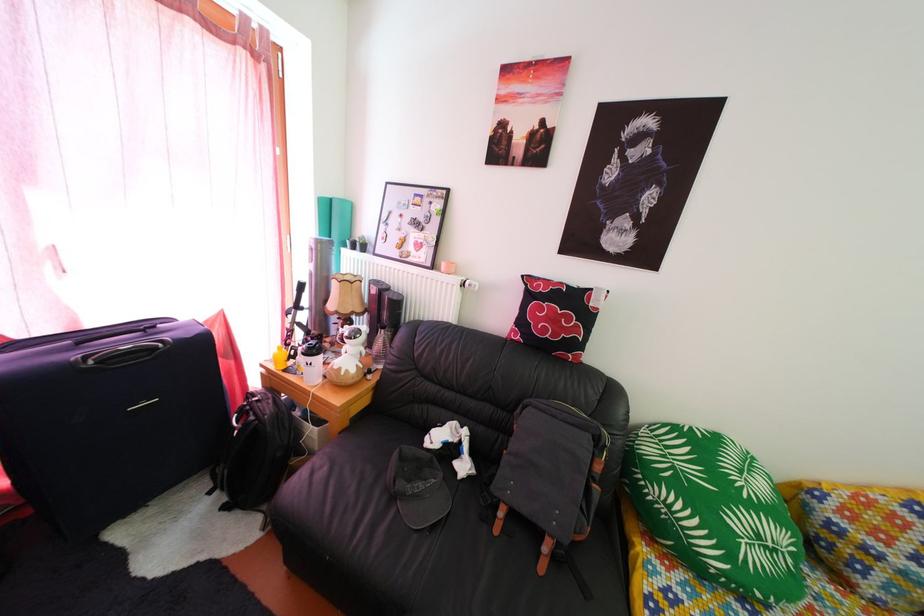
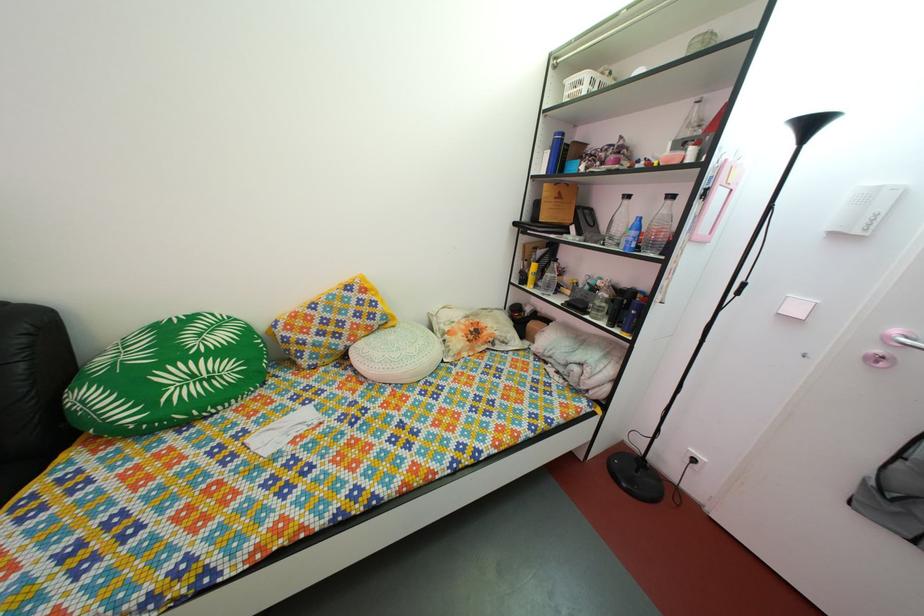
Where in the second image is the point corresponding to point (784, 560) from the first image?

(220, 387)